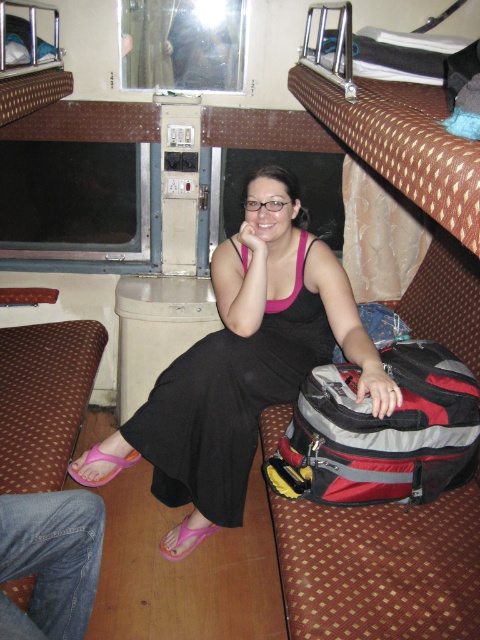
You are standing inside the train sleeper car and want to place a small plant on the closest point between point (349, 432) and point (215, 529). Which point should you choose?

Point (349, 432) is closer to the viewer than point (215, 529), so you should choose point (349, 432) to place the small plant.

You are a passenger in the sleeper car and need to put your shoes away. You see a pink rubber sandal at lower left and a pink fabric sandal at lower center. Which sandal is closer to the left side of the compartment?

The pink rubber sandal at lower left is positioned on the left side of pink fabric sandal at lower center, so it is closer to the left side of the compartment.

You are a passenger in the sleeper car and want to put your belongings in order. You have a black satin dress at center and a pink fabric sandal at lower center. Which item is positioned to the right of the other?

The black satin dress at center is to the right of pink fabric sandal at lower center.